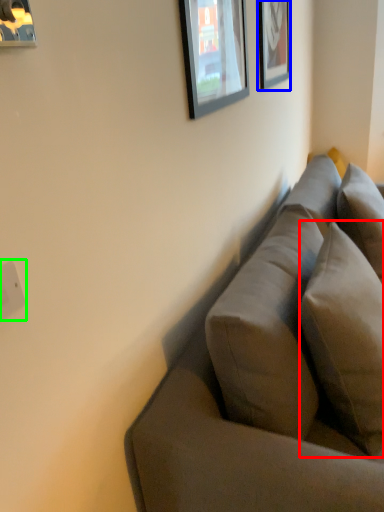
Question: Which object is the closest to the pillow (highlighted by a red box)? Choose among these: picture frame (highlighted by a blue box) or electric outlet (highlighted by a green box).

Choices:
 (A) picture frame
 (B) electric outlet

Answer: (B)